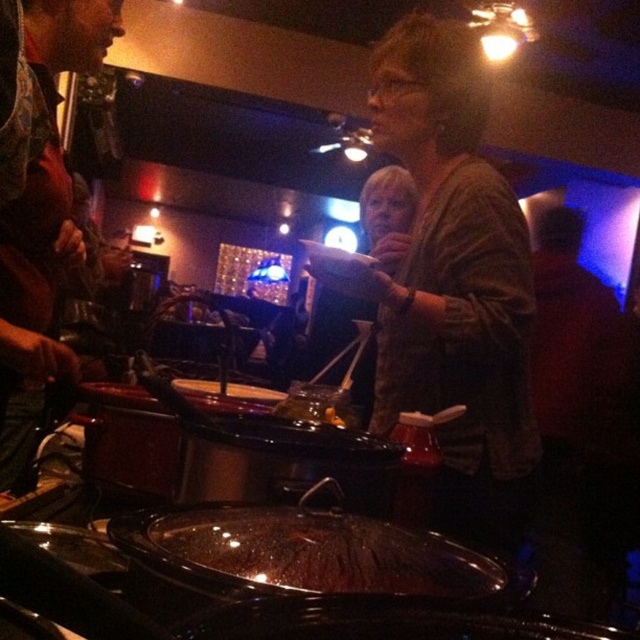
You are a server in a restaurant and need to place a dessert on the translucent glass plate at center without disturbing the brown textured sweater at upper right. Which direction should you approach from?

You should approach from the left side of the translucent glass plate at center since the brown textured sweater at upper right is located to its right, allowing you to place the dessert without disturbing it.

You are standing in the dining area and want to locate the brown textured sweater at upper right. According to the coordinates provided, where exactly is it positioned?

The brown textured sweater at upper right is located at the 2D coordinates point (452, 282).

You are a server in a restaurant and need to place a dessert on the translucent glass plate at center without it touching the brown textured sweater at upper right. Can you fit the dessert on the plate if the dessert is as wide as the sweater?

The brown textured sweater at upper right is wider than the translucent glass plate at center. Since the dessert is as wide as the sweater, it would not fit on the plate, which is narrower.